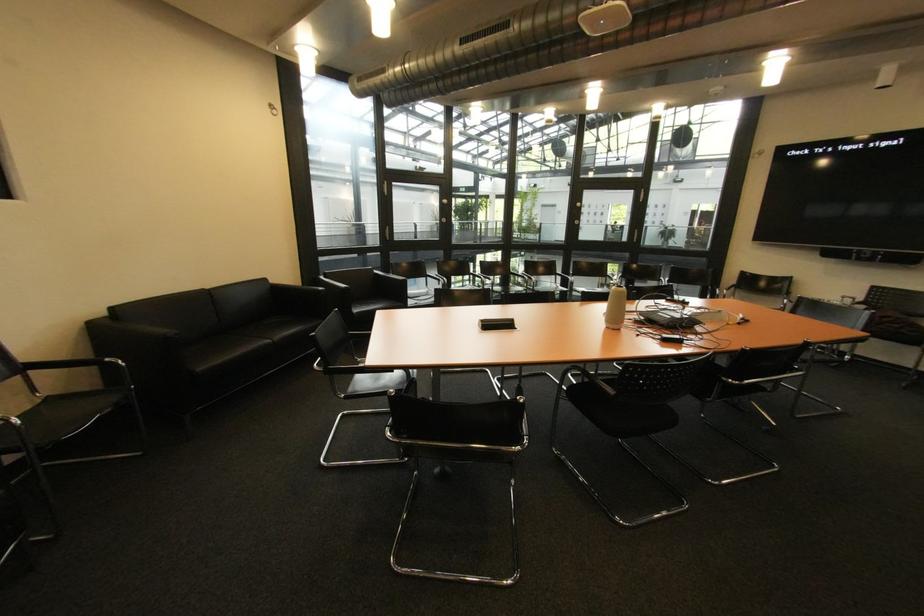
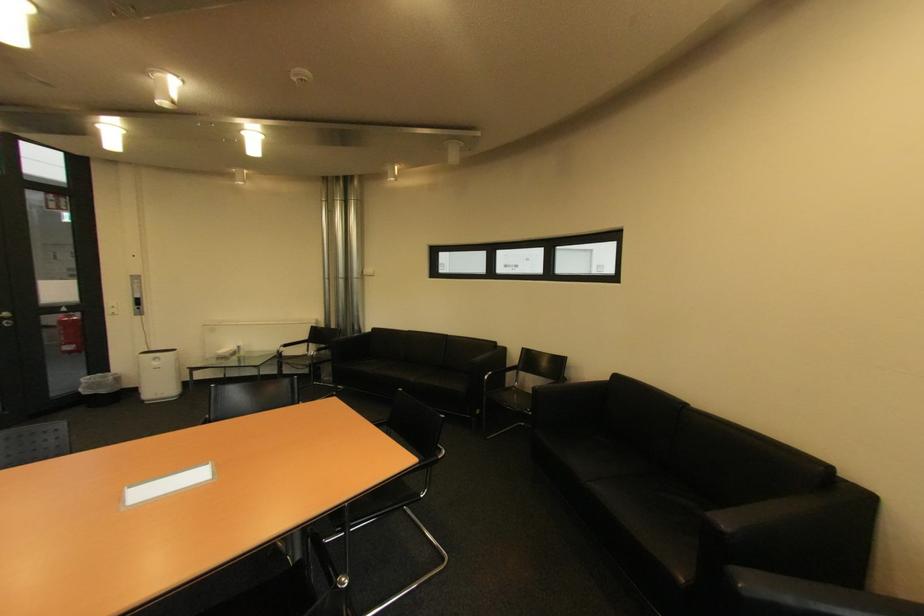
Where in the second image is the point corresponding to the point at 120,310 from the first image?

(625, 378)